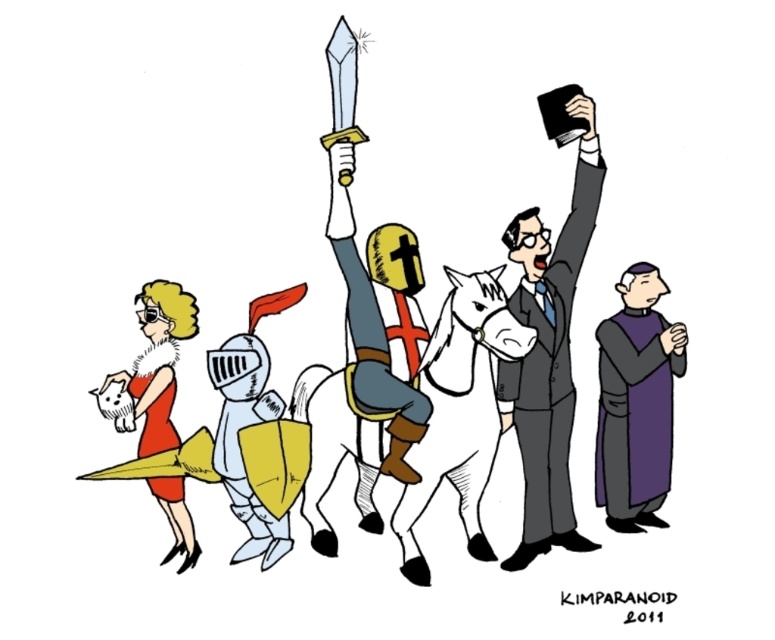
Question: Considering the real-world distances, which object is farthest from the purple velvet robe at right?

Choices:
 (A) matte red dress at left
 (B) gray suit at right

Answer: (A)

Question: Does purple velvet robe at right appear under matte red dress at left?

Choices:
 (A) yes
 (B) no

Answer: (A)

Question: Does gray suit at right appear on the right side of purple velvet robe at right?

Choices:
 (A) no
 (B) yes

Answer: (A)

Question: Which object is the farthest from the purple velvet robe at right?

Choices:
 (A) matte red dress at left
 (B) gray suit at right

Answer: (A)

Question: Which of the following is the closest to the observer?

Choices:
 (A) purple velvet robe at right
 (B) gray suit at right
 (C) matte red dress at left

Answer: (B)

Question: Does purple velvet robe at right have a smaller size compared to matte red dress at left?

Choices:
 (A) no
 (B) yes

Answer: (A)